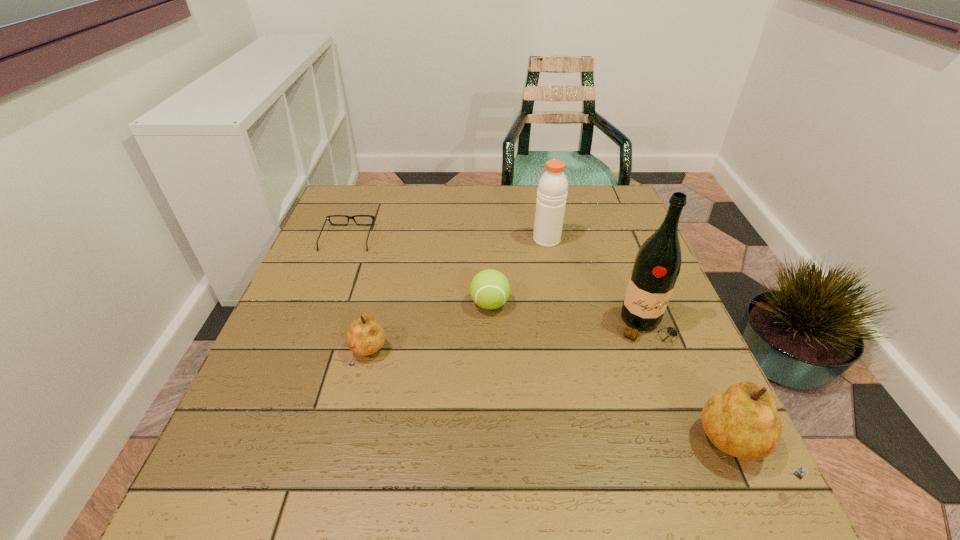
Image resolution: width=960 pixels, height=540 pixels. What are the coordinates of `vacant space situated on the right of the fifth object from right to left` in the screenshot? It's located at (506, 355).

You are a GUI agent. You are given a task and a screenshot of the screen. Output one action in this format:
    pyautogui.click(x=<x>, y=<y>)
    Task: Click on the free space located 0.280m on the left of the right pear
    This screenshot has width=960, height=540.
    Given the screenshot: What is the action you would take?
    pyautogui.click(x=538, y=450)

Find the location of `free space located 0.210m on the left of the fifth shortest object`. free space located 0.210m on the left of the fifth shortest object is located at coordinates (457, 240).

The width and height of the screenshot is (960, 540). Identify the location of vacant point located on the surface of the wine bottle. (685, 433).

This screenshot has width=960, height=540. Find the location of `vacant space located on the front-facing side of the spectacles`. vacant space located on the front-facing side of the spectacles is located at coordinates point(359,208).

Identify the location of free spot located 0.170m on the front-facing side of the spectacles. This screenshot has width=960, height=540. (364, 195).

Image resolution: width=960 pixels, height=540 pixels. Find the location of `vacant space positioned 0.210m on the front-facing side of the spectacles`. vacant space positioned 0.210m on the front-facing side of the spectacles is located at coordinates (367, 188).

At what (x,y) coordinates should I click in order to perform the action: click on free space located on the front of the fourth object from right to left. Please return your answer as a coordinate pair (x, y). Looking at the image, I should click on (492, 384).

Where is `object located in the far edge section of the desktop`? Image resolution: width=960 pixels, height=540 pixels. object located in the far edge section of the desktop is located at coordinates (328, 217).

At what (x,y) coordinates should I click in order to perform the action: click on object that is at the near edge. Please return your answer as a coordinate pair (x, y). This screenshot has height=540, width=960. Looking at the image, I should click on (742, 421).